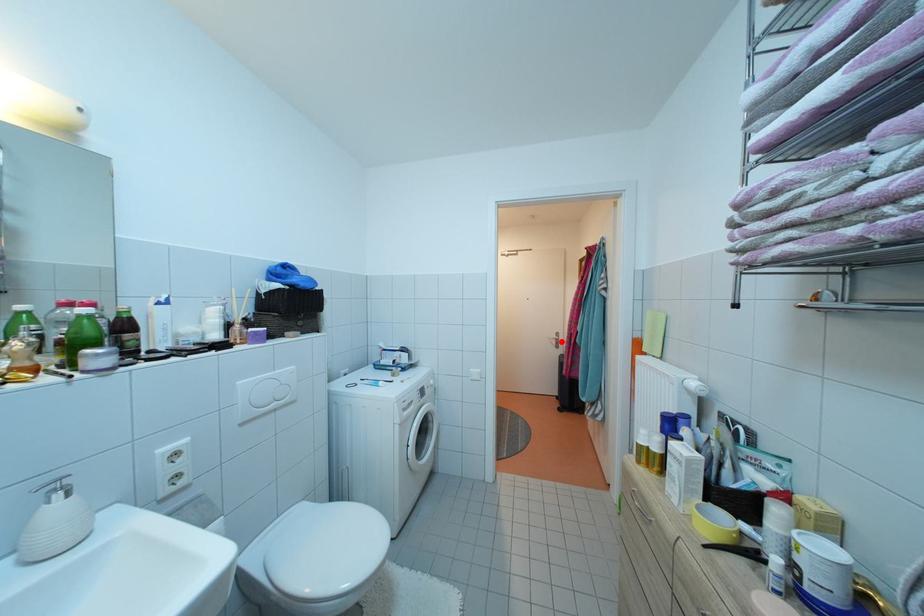
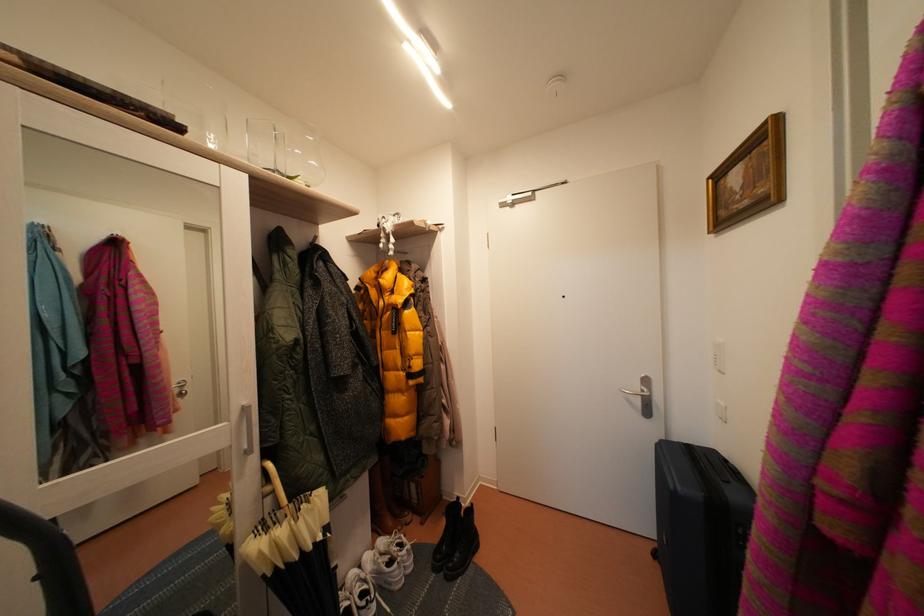
Where in the second image is the point corresponding to the highlighted location from the first image?

(645, 392)